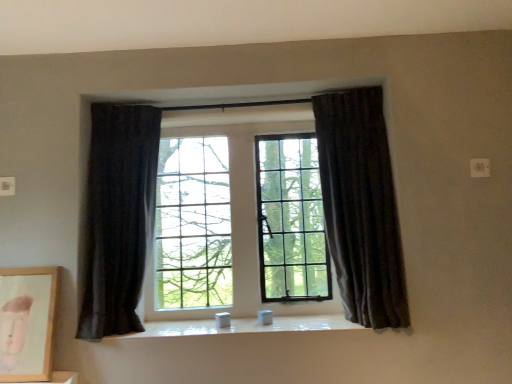
This screenshot has width=512, height=384. What do you see at coordinates (27, 322) in the screenshot?
I see `matte wooden picture frame at lower left` at bounding box center [27, 322].

Measure the distance between point (179, 323) and camera.

A distance of 2.16 meters exists between point (179, 323) and camera.

Describe the element at coordinates (361, 206) in the screenshot. I see `dark velvet curtain at right, arranged as the 2th curtain when viewed from the left` at that location.

This screenshot has height=384, width=512. In order to click on matte wooden picture frame at lower left in this screenshot , I will do `click(27, 322)`.

From the image's perspective, which object appears higher, dark velvet curtain at right, arranged as the 2th curtain when viewed from the left, or matte wooden picture frame at lower left?

dark velvet curtain at right, arranged as the 2th curtain when viewed from the left, appears higher in the image.

In the scene shown: Is dark velvet curtain at right, which ranks as the 1th curtain in right-to-left order, oriented away from matte wooden picture frame at lower left?

No, dark velvet curtain at right, which ranks as the 1th curtain in right-to-left order, is not facing the opposite direction of matte wooden picture frame at lower left.

Who is taller, dark velvet curtain at right, arranged as the 2th curtain when viewed from the left, or matte wooden picture frame at lower left?

dark velvet curtain at right, arranged as the 2th curtain when viewed from the left, is taller.

Can you confirm if dark fabric curtain at left, arranged as the second curtain when viewed from the right, is shorter than white glossy window sill at center?

In fact, dark fabric curtain at left, arranged as the second curtain when viewed from the right, may be taller than white glossy window sill at center.

Between dark fabric curtain at left, positioned as the 1th curtain in left-to-right order, and white glossy window sill at center, which one appears on the left side from the viewer's perspective?

Positioned to the left is dark fabric curtain at left, positioned as the 1th curtain in left-to-right order.

Which object is wider, dark fabric curtain at left, positioned as the 1th curtain in left-to-right order, or white glossy window sill at center?

Wider between the two is white glossy window sill at center.

Is dark fabric curtain at left, arranged as the second curtain when viewed from the right, aimed at white glossy window sill at center?

No, dark fabric curtain at left, arranged as the second curtain when viewed from the right, does not turn towards white glossy window sill at center.

How distant is matte wooden picture frame at lower left from dark fabric curtain at left, arranged as the second curtain when viewed from the right?

matte wooden picture frame at lower left is 12.13 inches from dark fabric curtain at left, arranged as the second curtain when viewed from the right.

From their relative heights in the image, would you say matte wooden picture frame at lower left is taller or shorter than dark fabric curtain at left, arranged as the second curtain when viewed from the right?

In the image, matte wooden picture frame at lower left appears to be shorter than dark fabric curtain at left, arranged as the second curtain when viewed from the right.

From the image's perspective, would you say matte wooden picture frame at lower left is positioned over dark fabric curtain at left, arranged as the second curtain when viewed from the right?

Actually, matte wooden picture frame at lower left appears below dark fabric curtain at left, arranged as the second curtain when viewed from the right, in the image.

Does matte wooden picture frame at lower left contain dark fabric curtain at left, positioned as the 1th curtain in left-to-right order?

No, dark fabric curtain at left, positioned as the 1th curtain in left-to-right order, is not a part of matte wooden picture frame at lower left.

From a real-world perspective, which object stands above the other?

In real-world perspective, dark velvet curtain at right, which ranks as the 1th curtain in right-to-left order, is above.

From the image's perspective, who appears lower, matte wooden picture frame at lower left or dark velvet curtain at right, arranged as the 2th curtain when viewed from the left?

From the image's view, matte wooden picture frame at lower left is below.

From a real-world perspective, count 2nd curtains upward from the matte wooden picture frame at lower left and point to it. Please provide its 2D coordinates.

[(361, 206)]

How far apart are matte wooden picture frame at lower left and dark velvet curtain at right, which ranks as the 1th curtain in right-to-left order?

matte wooden picture frame at lower left and dark velvet curtain at right, which ranks as the 1th curtain in right-to-left order, are 4.65 feet apart from each other.

From the white glossy window sill at center, count 1st curtains forward and point to it. Please provide its 2D coordinates.

[(117, 217)]

Which of these two, white glossy window sill at center or dark fabric curtain at left, arranged as the second curtain when viewed from the right, is wider?

white glossy window sill at center.

Considering the sizes of white glossy window sill at center and dark fabric curtain at left, positioned as the 1th curtain in left-to-right order, in the image, is white glossy window sill at center taller or shorter than dark fabric curtain at left, positioned as the 1th curtain in left-to-right order,?

In the image, white glossy window sill at center appears to be shorter than dark fabric curtain at left, positioned as the 1th curtain in left-to-right order.

Is white glossy window sill at center looking in the opposite direction of dark velvet curtain at right, which ranks as the 1th curtain in right-to-left order?

That's not correct — white glossy window sill at center is not looking away from dark velvet curtain at right, which ranks as the 1th curtain in right-to-left order.

Relative to dark velvet curtain at right, arranged as the 2th curtain when viewed from the left, is white glossy window sill at center in front or behind?

white glossy window sill at center is behind dark velvet curtain at right, arranged as the 2th curtain when viewed from the left.

Does point (170, 322) come closer to viewer compared to point (349, 308)?

No.

From a real-world perspective, between white glossy window sill at center and dark velvet curtain at right, arranged as the 2th curtain when viewed from the left, who is vertically higher?

From a 3D spatial view, dark velvet curtain at right, arranged as the 2th curtain when viewed from the left, is above.

Which is closer, (172,335) or (37,292)?

Clearly, point (172,335) is more distant from the camera than point (37,292).

Is white glossy window sill at center positioned beyond the bounds of matte wooden picture frame at lower left?

Absolutely, white glossy window sill at center is external to matte wooden picture frame at lower left.

Is white glossy window sill at center to the left or to the right of matte wooden picture frame at lower left in the image?

Based on their positions, white glossy window sill at center is located to the right of matte wooden picture frame at lower left.

Find the location of a particular element. This screenshot has width=512, height=384. window sill behind the matte wooden picture frame at lower left is located at coordinates (243, 326).

In the image, there is a dark velvet curtain at right, which ranks as the 1th curtain in right-to-left order. At what (x,y) coordinates should I click in order to perform the action: click on picture frame below it (from the image's perspective). Please return your answer as a coordinate pair (x, y). Looking at the image, I should click on 27,322.

Identify the location of curtain on the left of white glossy window sill at center. This screenshot has height=384, width=512. (117, 217).

From the image, which object appears to be farther from dark fabric curtain at left, arranged as the second curtain when viewed from the right, white glossy window sill at center or matte wooden picture frame at lower left?

The object further to dark fabric curtain at left, arranged as the second curtain when viewed from the right, is white glossy window sill at center.

Estimate the real-world distances between objects in this image. Which object is further from matte wooden picture frame at lower left, dark fabric curtain at left, positioned as the 1th curtain in left-to-right order, or white glossy window sill at center?

Among the two, white glossy window sill at center is located further to matte wooden picture frame at lower left.

Considering their positions, is dark fabric curtain at left, arranged as the second curtain when viewed from the right, positioned further to matte wooden picture frame at lower left than dark velvet curtain at right, which ranks as the 1th curtain in right-to-left order?

The object further to matte wooden picture frame at lower left is dark velvet curtain at right, which ranks as the 1th curtain in right-to-left order.

Estimate the real-world distances between objects in this image. Which object is closer to dark fabric curtain at left, arranged as the second curtain when viewed from the right, dark velvet curtain at right, which ranks as the 1th curtain in right-to-left order, or white glossy window sill at center?

white glossy window sill at center lies closer to dark fabric curtain at left, arranged as the second curtain when viewed from the right, than the other object.

From the image, which object appears to be farther from white glossy window sill at center, matte wooden picture frame at lower left or dark velvet curtain at right, which ranks as the 1th curtain in right-to-left order?

dark velvet curtain at right, which ranks as the 1th curtain in right-to-left order, is positioned further to the anchor white glossy window sill at center.

From the image, which object appears to be farther from dark fabric curtain at left, positioned as the 1th curtain in left-to-right order, matte wooden picture frame at lower left or white glossy window sill at center?

white glossy window sill at center is further to dark fabric curtain at left, positioned as the 1th curtain in left-to-right order.

Considering their positions, is dark velvet curtain at right, which ranks as the 1th curtain in right-to-left order, positioned further to white glossy window sill at center than dark fabric curtain at left, positioned as the 1th curtain in left-to-right order?

dark velvet curtain at right, which ranks as the 1th curtain in right-to-left order, lies further to white glossy window sill at center than the other object.

Which object lies further to the anchor point matte wooden picture frame at lower left, dark velvet curtain at right, which ranks as the 1th curtain in right-to-left order, or dark fabric curtain at left, arranged as the second curtain when viewed from the right?

Based on the image, dark velvet curtain at right, which ranks as the 1th curtain in right-to-left order, appears to be further to matte wooden picture frame at lower left.

The height and width of the screenshot is (384, 512). I want to click on curtain between matte wooden picture frame at lower left and dark velvet curtain at right, which ranks as the 1th curtain in right-to-left order, from left to right, so click(117, 217).

The width and height of the screenshot is (512, 384). Identify the location of window sill situated between dark fabric curtain at left, positioned as the 1th curtain in left-to-right order, and dark velvet curtain at right, arranged as the 2th curtain when viewed from the left, from left to right. (243, 326).

Identify the location of curtain situated between matte wooden picture frame at lower left and white glossy window sill at center from left to right. (117, 217).

Find the location of `window sill between matte wooden picture frame at lower left and dark velvet curtain at right, arranged as the 2th curtain when viewed from the left, in the horizontal direction`. window sill between matte wooden picture frame at lower left and dark velvet curtain at right, arranged as the 2th curtain when viewed from the left, in the horizontal direction is located at coordinates (243, 326).